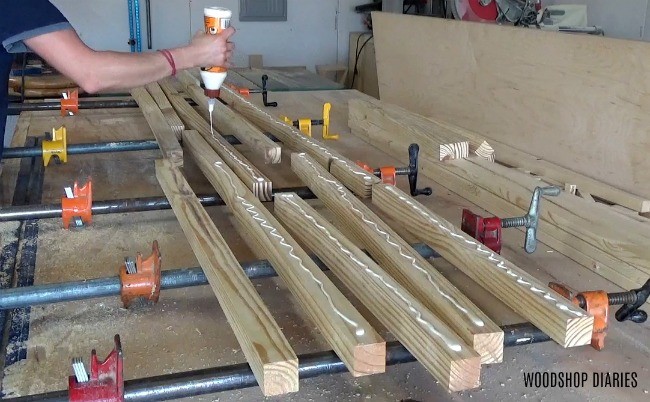
The width and height of the screenshot is (650, 402). I want to click on wall, so click(x=320, y=33), click(x=636, y=24).